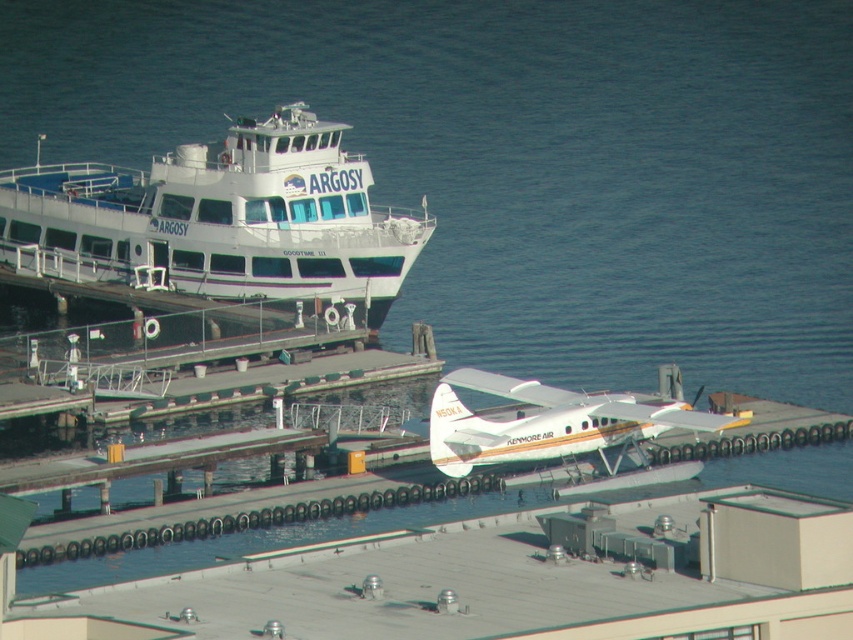
Question: Is white glossy ferry boat at upper left further to camera compared to white matte seaplane at center?

Choices:
 (A) yes
 (B) no

Answer: (A)

Question: Is white glossy ferry boat at upper left behind white matte seaplane at center?

Choices:
 (A) yes
 (B) no

Answer: (A)

Question: Which of the following is the farthest from the observer?

Choices:
 (A) white glossy ferry boat at upper left
 (B) white matte seaplane at center

Answer: (A)

Question: Which object appears farthest from the camera in this image?

Choices:
 (A) white matte seaplane at center
 (B) white glossy ferry boat at upper left

Answer: (B)

Question: Is white glossy ferry boat at upper left smaller than white matte seaplane at center?

Choices:
 (A) no
 (B) yes

Answer: (A)

Question: Among these points, which one is nearest to the camera?

Choices:
 (A) (187, 173)
 (B) (637, 401)

Answer: (B)